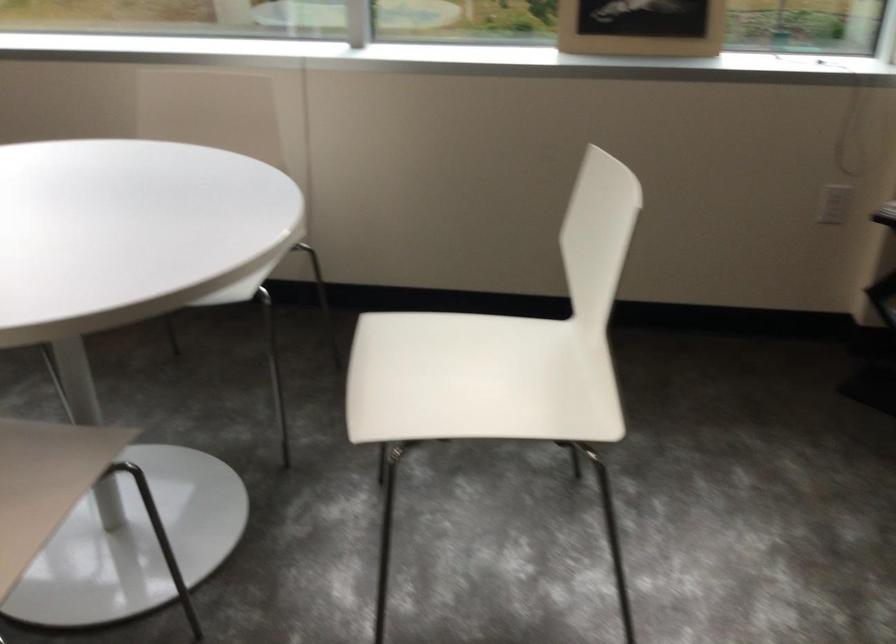
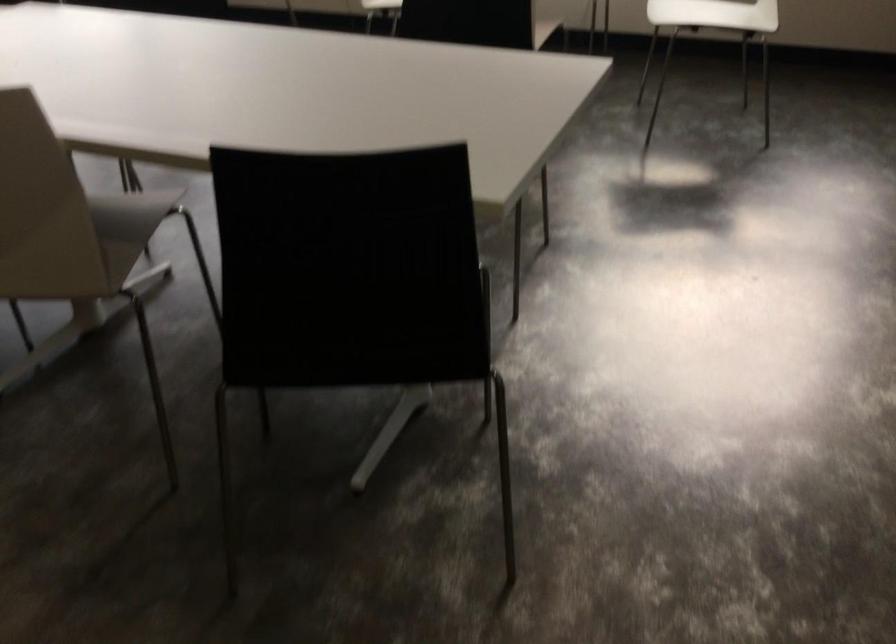
Question: In a continuous first-person perspective shot, in which direction is the camera moving?

Choices:
 (A) Left
 (B) Right
 (C) Forward
 (D) Backward

Answer: (D)